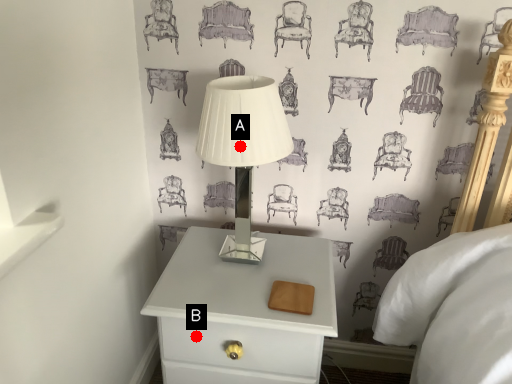
Question: Two points are circled on the image, labeled by A and B beside each circle. Which point is farther from the camera taking this photo?

Choices:
 (A) A is further
 (B) B is further

Answer: (B)